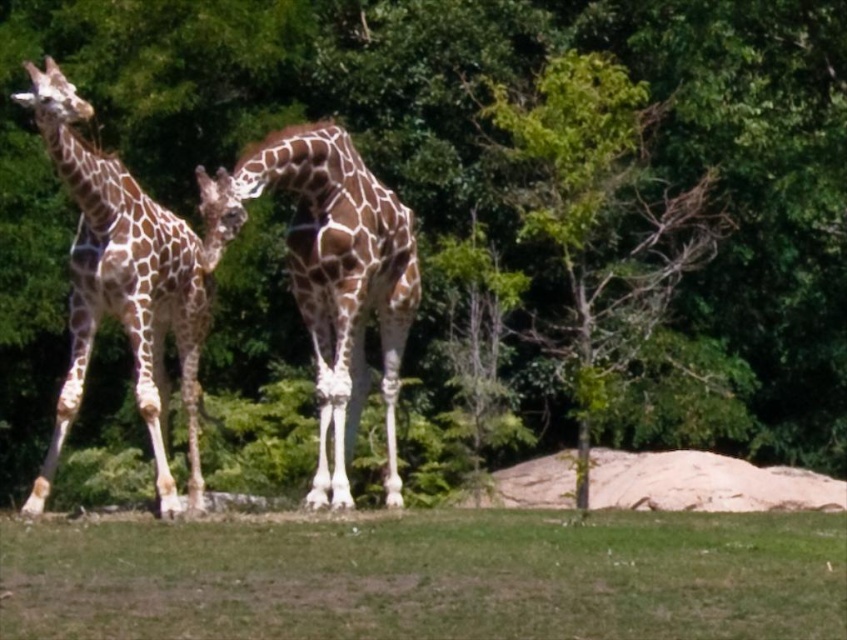
Is brown spotted giraffe at center smaller than spotted giraffe at left?

No, brown spotted giraffe at center is not smaller than spotted giraffe at left.

Does brown spotted giraffe at center appear on the right side of spotted giraffe at left?

Indeed, brown spotted giraffe at center is positioned on the right side of spotted giraffe at left.

Image resolution: width=847 pixels, height=640 pixels. What do you see at coordinates (330, 275) in the screenshot? I see `brown spotted giraffe at center` at bounding box center [330, 275].

Where is `brown spotted giraffe at center`? Image resolution: width=847 pixels, height=640 pixels. brown spotted giraffe at center is located at coordinates (330, 275).

Is green grass at lower center shorter than brown spotted giraffe at center?

Correct, green grass at lower center is not as tall as brown spotted giraffe at center.

The height and width of the screenshot is (640, 847). Describe the element at coordinates (429, 577) in the screenshot. I see `green grass at lower center` at that location.

Does point (646, 592) come in front of point (341, 282)?

Yes, it is in front of point (341, 282).

I want to click on green grass at lower center, so click(x=429, y=577).

Can you confirm if green grass at lower center is shorter than green leafy tree at center?

Correct, green grass at lower center is not as tall as green leafy tree at center.

Which is in front, point (39, 627) or point (587, 456)?

Point (39, 627) is more forward.

Which is behind, point (84, 561) or point (546, 332)?

The point (546, 332) is behind.

Where is `green grass at lower center`? green grass at lower center is located at coordinates (429, 577).